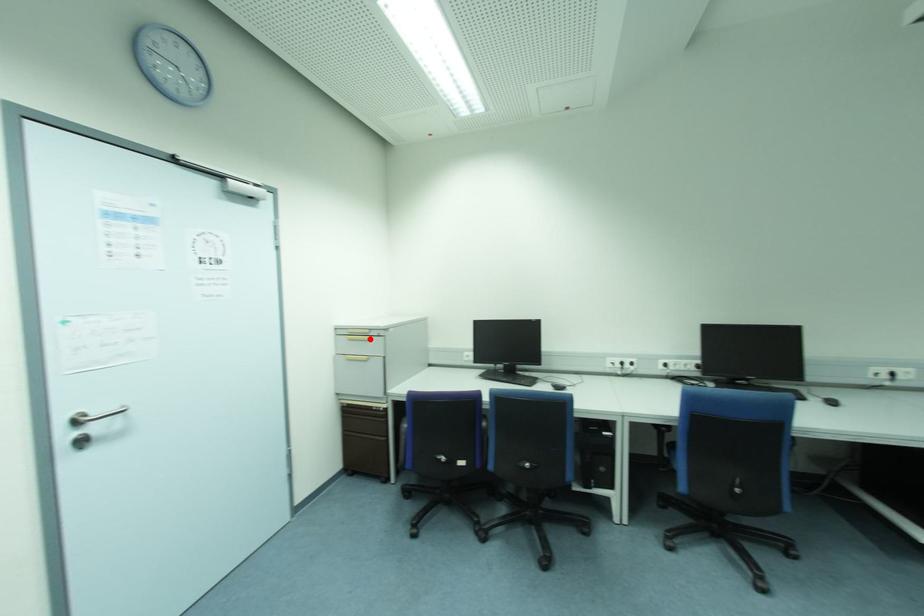
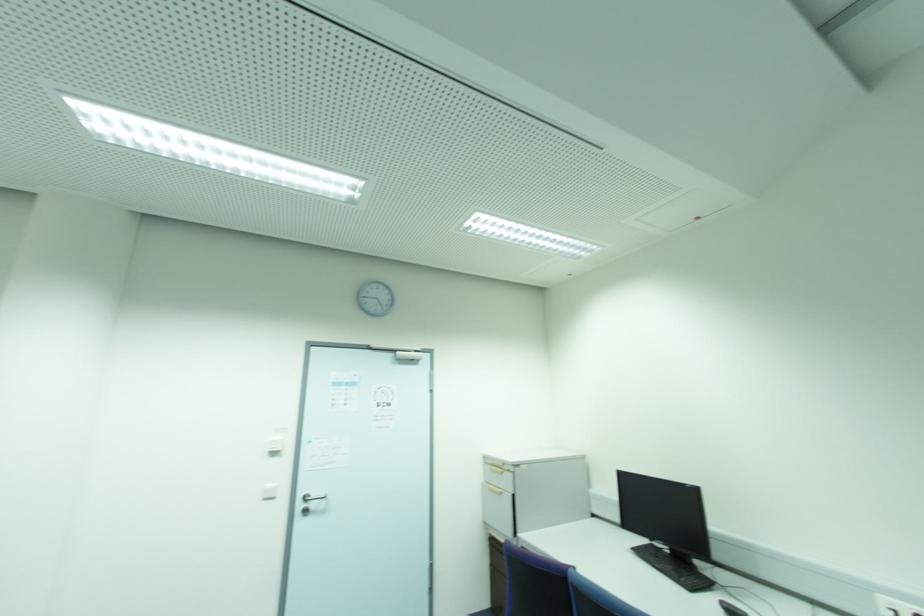
Find the pixel in the second image that matches the highlighted location in the first image.

(503, 472)